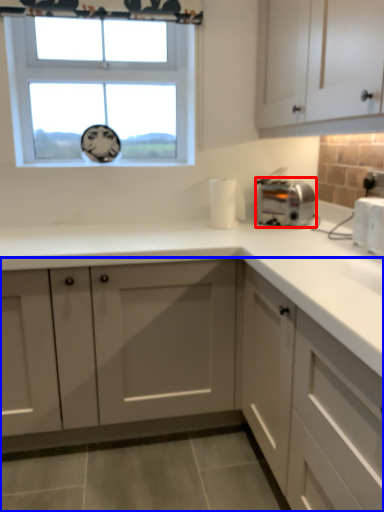
Question: Which object appears farthest to the camera in this image, toaster (highlighted by a red box) or cabinetry (highlighted by a blue box)?

Choices:
 (A) toaster
 (B) cabinetry

Answer: (A)